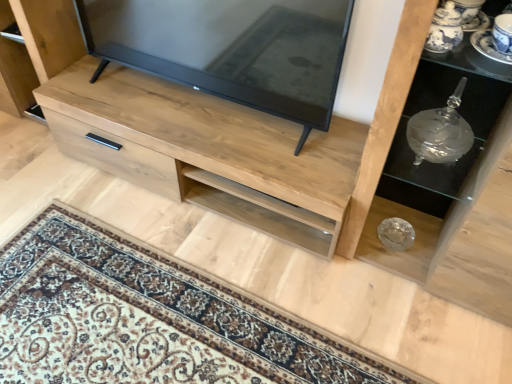
Image resolution: width=512 pixels, height=384 pixels. Identify the location of free area below matte black tv at center (from a real-world perspective). [202, 111].